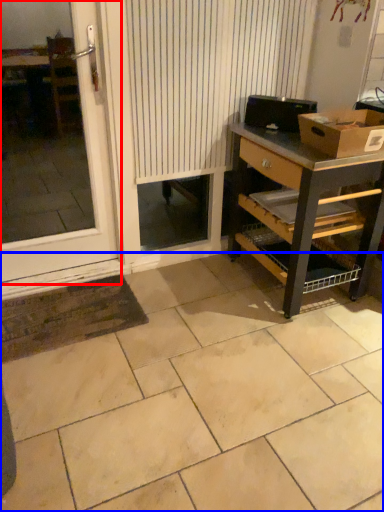
Question: Which point is further to the camera, window (highlighted by a red box) or ceramic tile (highlighted by a blue box)?

Choices:
 (A) window
 (B) ceramic tile

Answer: (A)